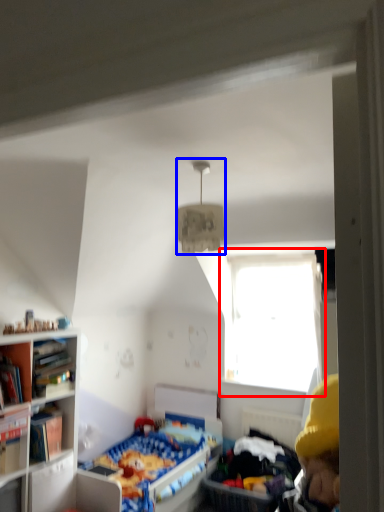
Question: Which object is closer to the camera taking this photo, window (highlighted by a red box) or light fixture (highlighted by a blue box)?

Choices:
 (A) window
 (B) light fixture

Answer: (B)